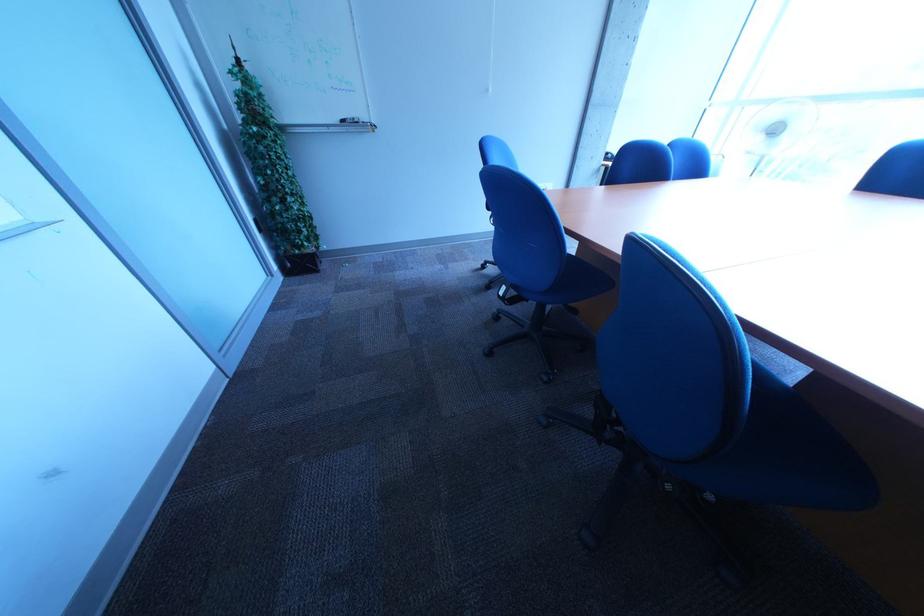
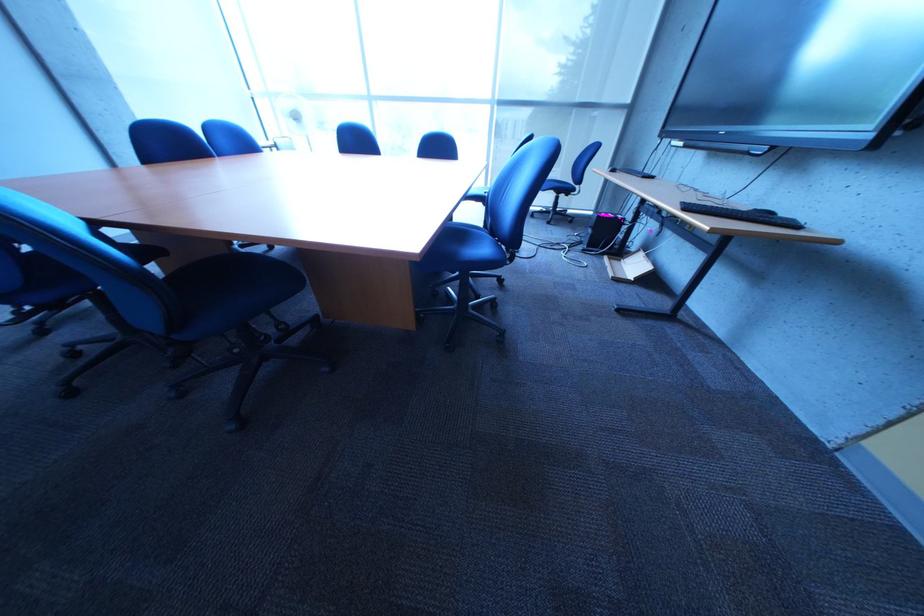
How did the camera likely rotate?

The rotation direction of the camera is right-down.